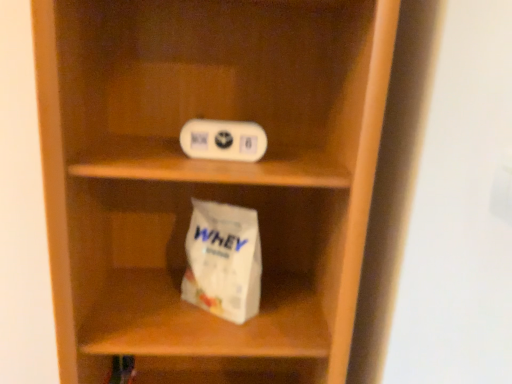
Image resolution: width=512 pixels, height=384 pixels. Find the location of `white matte paper bag at lower center`. white matte paper bag at lower center is located at coordinates (223, 261).

Consider the image. Is white matte paper bag at lower center positioned with its back to white plastic ipod at upper center?

white matte paper bag at lower center is not turned away from white plastic ipod at upper center.

Looking at this image, which is behind, white matte paper bag at lower center or white plastic ipod at upper center?

white matte paper bag at lower center is further from the camera.

How many degrees apart are the facing directions of white matte paper bag at lower center and white plastic ipod at upper center?

The angular difference between white matte paper bag at lower center and white plastic ipod at upper center is 33.3 degrees.

From the picture: Does white matte paper bag at lower center have a lesser height compared to white plastic ipod at upper center?

In fact, white matte paper bag at lower center may be taller than white plastic ipod at upper center.

Would you say white plastic ipod at upper center is to the left or to the right of wooden shelf at center in the picture?

white plastic ipod at upper center is positioned on wooden shelf at center's right side.

Considering the positions of objects white plastic ipod at upper center and wooden shelf at center in the image provided, who is behind, white plastic ipod at upper center or wooden shelf at center?

Positioned behind is white plastic ipod at upper center.

Between white plastic ipod at upper center and wooden shelf at center, which one has larger size?

wooden shelf at center.

Identify the location of paper bag behind the wooden shelf at center. Image resolution: width=512 pixels, height=384 pixels. (223, 261).

Visually, is white matte paper bag at lower center positioned to the left or to the right of wooden shelf at center?

In the image, white matte paper bag at lower center appears on the right side of wooden shelf at center.

From the image's perspective, which one is positioned higher, white matte paper bag at lower center or wooden shelf at center?

wooden shelf at center is shown above in the image.

Looking at this image, is white matte paper bag at lower center looking in the opposite direction of wooden shelf at center?

That's right, white matte paper bag at lower center is facing away from wooden shelf at center.

From a real-world perspective, is white plastic ipod at upper center on top of white matte paper bag at lower center?

Yes.

From the picture: Is white plastic ipod at upper center positioned with its back to white matte paper bag at lower center?

No, white matte paper bag at lower center is not at the back of white plastic ipod at upper center.

Which object is wider, white plastic ipod at upper center or white matte paper bag at lower center?

white matte paper bag at lower center.

Which is behind, white plastic ipod at upper center or white matte paper bag at lower center?

white matte paper bag at lower center is behind.

Is wooden shelf at center at the right side of white plastic ipod at upper center?

No.

Based on the photo, do you think wooden shelf at center is within white plastic ipod at upper center, or outside of it?

wooden shelf at center is outside white plastic ipod at upper center.

Is wooden shelf at center positioned far away from white plastic ipod at upper center?

No, wooden shelf at center is not far away from white plastic ipod at upper center.

Considering the positions of point (333, 143) and point (242, 123), is point (333, 143) closer or farther from the camera than point (242, 123)?

Clearly, point (333, 143) is more distant from the camera than point (242, 123).

Is wooden shelf at center facing away from white matte paper bag at lower center?

Yes, white matte paper bag at lower center is at the back of wooden shelf at center.

Find the location of a particular element. This screenshot has width=512, height=384. paper bag below the wooden shelf at center (from a real-world perspective) is located at coordinates (223, 261).

Does wooden shelf at center have a smaller size compared to white matte paper bag at lower center?

Actually, wooden shelf at center might be larger than white matte paper bag at lower center.

Does wooden shelf at center come in front of white matte paper bag at lower center?

Yes, it is in front of white matte paper bag at lower center.

Image resolution: width=512 pixels, height=384 pixels. I want to click on paper bag to the left of white plastic ipod at upper center, so click(223, 261).

This screenshot has height=384, width=512. I want to click on ipod above the wooden shelf at center (from the image's perspective), so click(223, 140).

When comparing their distances from wooden shelf at center, does white matte paper bag at lower center or white plastic ipod at upper center seem further?

Based on the image, white plastic ipod at upper center appears to be further to wooden shelf at center.

Based on their spatial positions, is white plastic ipod at upper center or wooden shelf at center further from white matte paper bag at lower center?

Based on the image, white plastic ipod at upper center appears to be further to white matte paper bag at lower center.

Looking at the image, which one is located closer to wooden shelf at center, white plastic ipod at upper center or white matte paper bag at lower center?

The object closer to wooden shelf at center is white matte paper bag at lower center.

Which object lies further to the anchor point white matte paper bag at lower center, wooden shelf at center or white plastic ipod at upper center?

white plastic ipod at upper center lies further to white matte paper bag at lower center than the other object.

Looking at the image, which one is located further to white plastic ipod at upper center, white matte paper bag at lower center or wooden shelf at center?

wooden shelf at center is positioned further to the anchor white plastic ipod at upper center.

Looking at the image, which one is located closer to white plastic ipod at upper center, wooden shelf at center or white matte paper bag at lower center?

Based on the image, white matte paper bag at lower center appears to be nearer to white plastic ipod at upper center.

Find the location of a particular element. This screenshot has width=512, height=384. ipod positioned between wooden shelf at center and white matte paper bag at lower center from near to far is located at coordinates (223, 140).